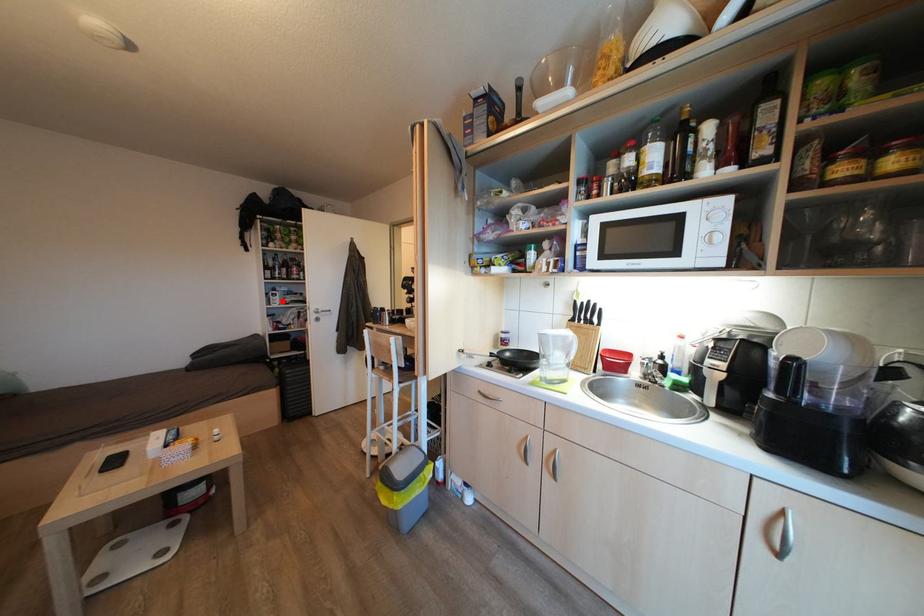
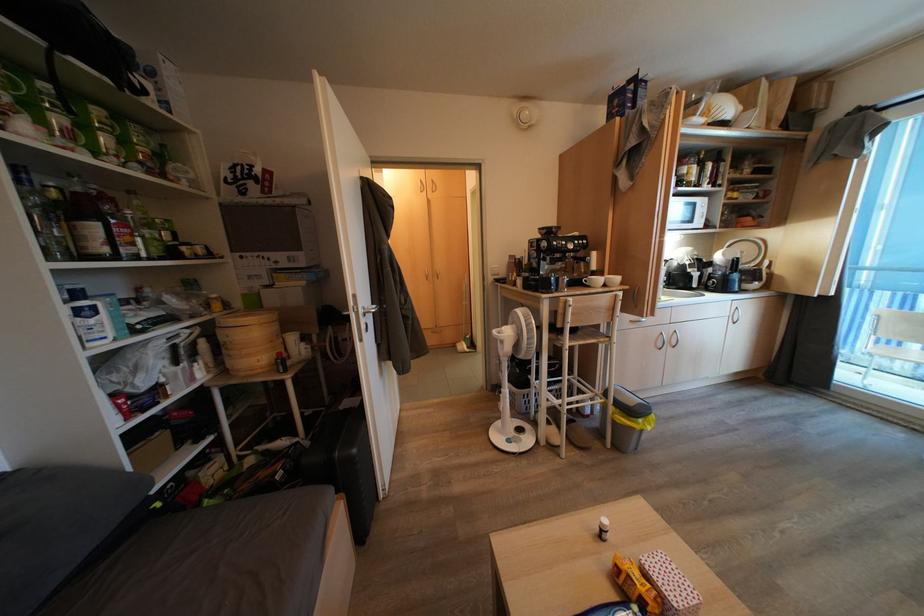
Question: I am providing you with two images of the same scene from different viewpoints. A red point is marked on the first image. At the location where the point appears in image 1, is it still visible in image 2?

Choices:
 (A) Yes
 (B) No

Answer: (A)